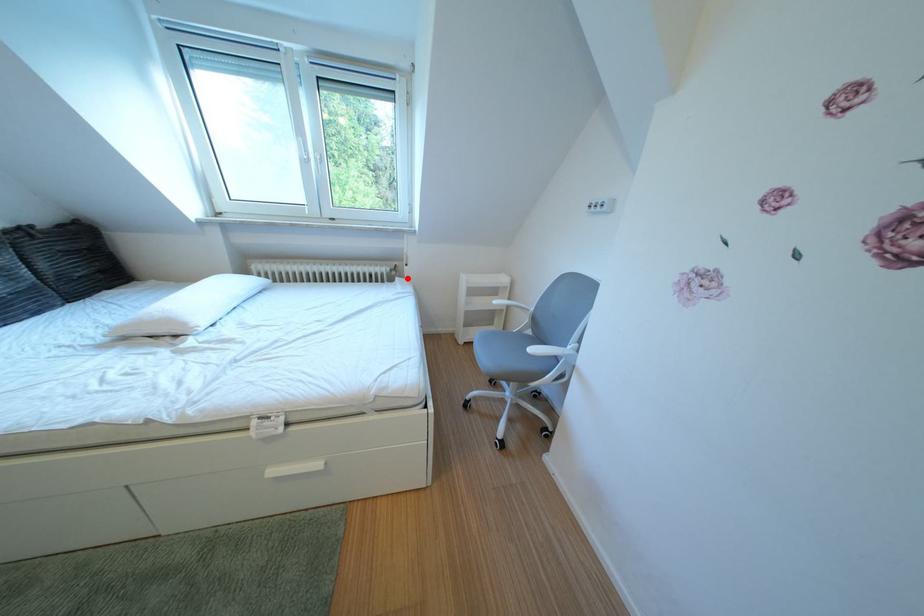
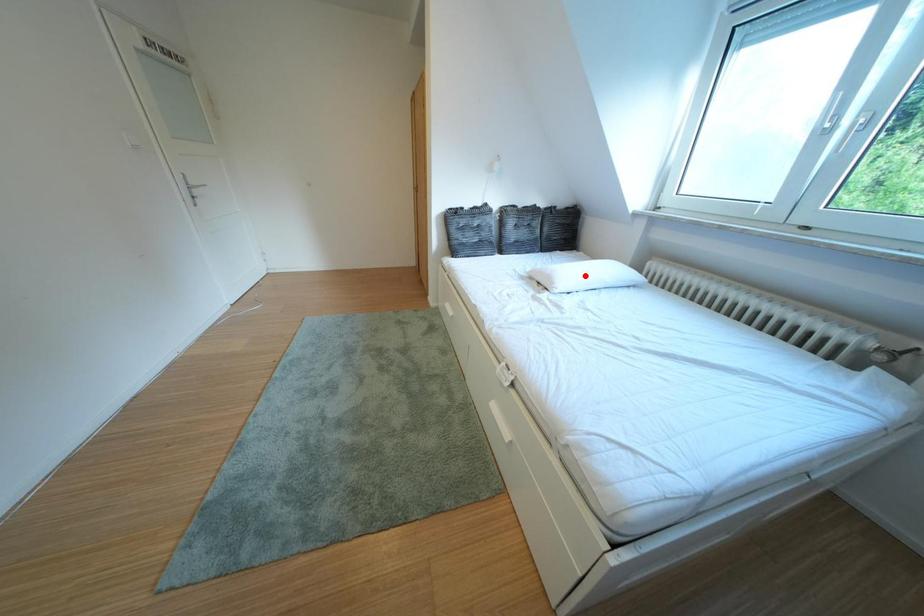
I am providing you with two images of the same scene from different viewpoints. A red point is marked on the first image and another point is marked on the second image. Are the points marked in image1 and image2 representing the same 3D position?

No